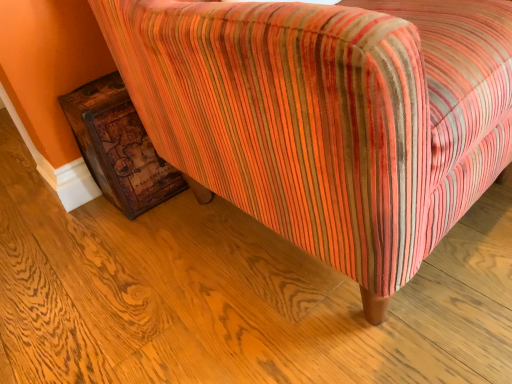
The width and height of the screenshot is (512, 384). Find the location of `free space that is in between striped fabric chair at lower right and distressed wood trunk at lower left`. free space that is in between striped fabric chair at lower right and distressed wood trunk at lower left is located at coordinates (200, 259).